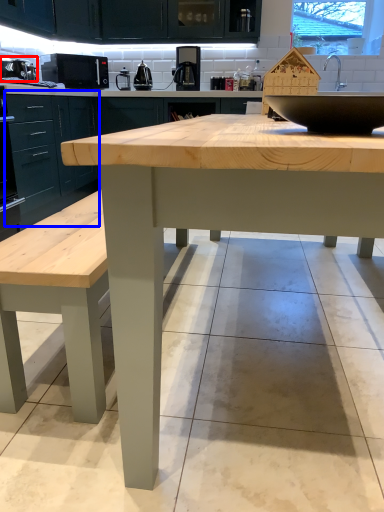
Question: Among these objects, which one is farthest to the camera, appliance (highlighted by a red box) or cabinetry (highlighted by a blue box)?

Choices:
 (A) appliance
 (B) cabinetry

Answer: (A)